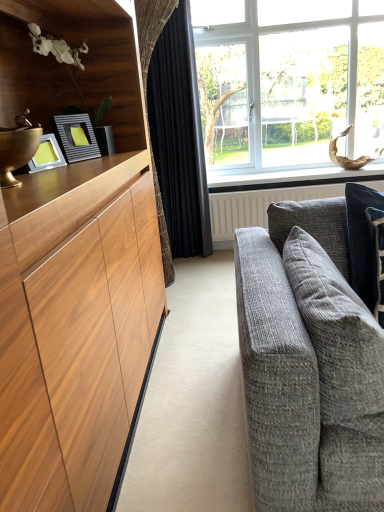
Question: Considering the positions of metallic silver picture frame at left and white painted wood at upper center in the image, is metallic silver picture frame at left wider or thinner than white painted wood at upper center?

Choices:
 (A) thin
 (B) wide

Answer: (A)

Question: Does point [61, 137] appear closer or farther from the camera than point [370, 175]?

Choices:
 (A) closer
 (B) farther

Answer: (A)

Question: Which of these objects is positioned farthest from the dark blue textured pillow at right, acting as the 2th pillow starting from the left?

Choices:
 (A) white painted wood at upper center
 (B) black velvet curtain at center
 (C) metallic silver picture frame at left
 (D) gray textured pillow at right, arranged as the first pillow when viewed from the left
 (E) white textured radiator at center

Answer: (B)

Question: Estimate the real-world distances between objects in this image. Which object is closer to the metallic silver picture frame at left?

Choices:
 (A) gray textured pillow at right, which is counted as the second pillow, starting from the right
 (B) clear glass window at upper right
 (C) white textured radiator at center
 (D) dark blue textured pillow at right, acting as the 2th pillow starting from the left
 (E) black velvet curtain at center

Answer: (A)